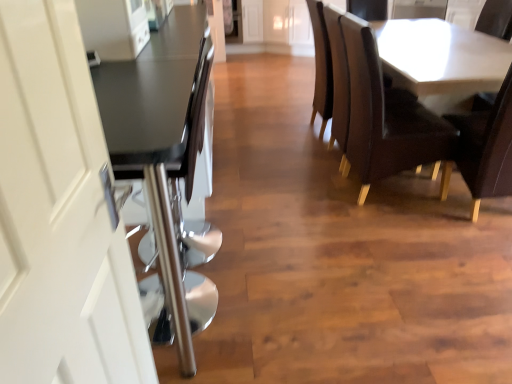
Question: Is point (118, 307) closer or farther from the camera than point (188, 312)?

Choices:
 (A) farther
 (B) closer

Answer: (B)

Question: Looking at the image, does white glossy door handle at left seem bigger or smaller compared to matte black table at left, arranged as the first table when viewed from the front?

Choices:
 (A) big
 (B) small

Answer: (B)

Question: Which object is the closest to the matte black table at left, arranged as the first table when viewed from the front?

Choices:
 (A) leather armchair at center
 (B) matte black countertop at left
 (C) white glossy table at upper right, the first table from the right
 (D) leather seat at right, which is the first chair in left-to-right order
 (E) white glossy door handle at left

Answer: (B)

Question: Which is nearer to the white glossy table at upper right, the first table from the right?

Choices:
 (A) leather seat at right, which ranks as the 2th chair in right-to-left order
 (B) matte black table at left, the 2th table when ordered from right to left
 (C) white glossy door handle at left
 (D) leather armchair at center
 (E) dark brown leather chair at right, which ranks as the 1th chair in right-to-left order

Answer: (A)